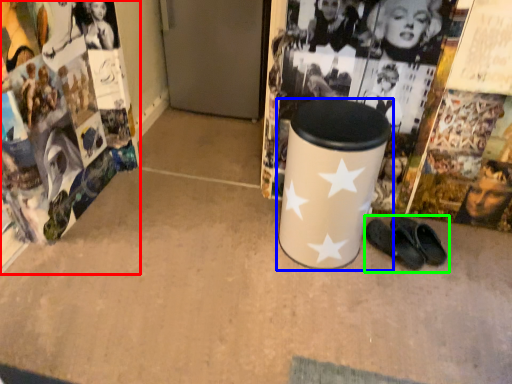
Question: Based on their relative distances, which object is farther from magazine (highlighted by a red box)? Choose from waste container (highlighted by a blue box) and footwear (highlighted by a green box).

Choices:
 (A) waste container
 (B) footwear

Answer: (B)